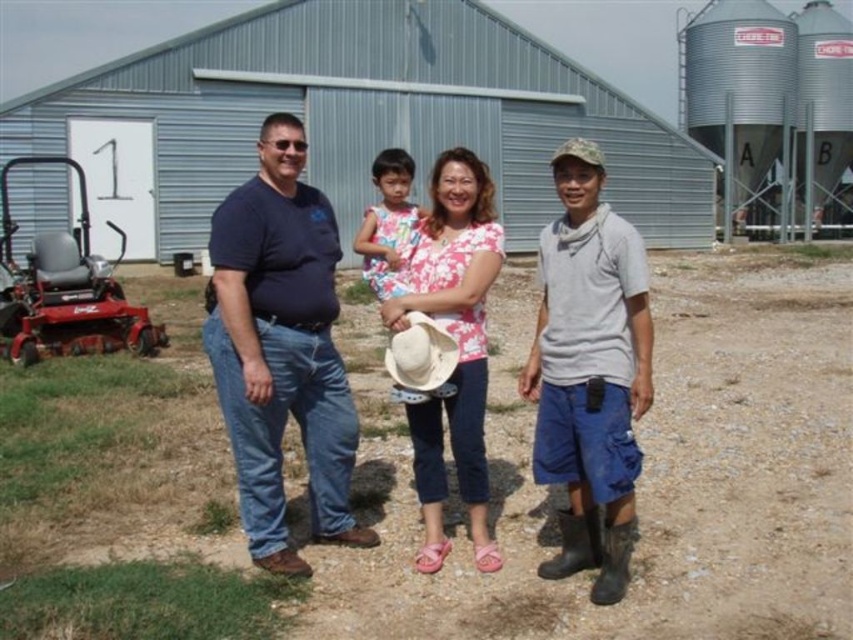
At what (x,y) coordinates should I click in order to perform the action: click on dirt at center. Please return your answer as a coordinate pair (x, y). This screenshot has width=853, height=640. Looking at the image, I should click on (451, 481).

Which is behind, point (802, 458) or point (453, 248)?

Positioned behind is point (802, 458).

The height and width of the screenshot is (640, 853). I want to click on dirt at center, so click(x=451, y=481).

Who is higher up, dirt at center or white matte cowboy hat at center?

white matte cowboy hat at center

Which is behind, point (186, 317) or point (421, 365)?

The point (186, 317) is more distant.

Is point (242, 593) in front of point (439, 358)?

Yes.

Locate an element on the screen. This screenshot has width=853, height=640. dirt at center is located at coordinates (451, 481).

Does floral fabric dress at center come in front of white matte cowboy hat at center?

No, floral fabric dress at center is further to the viewer.

Does floral fabric dress at center have a smaller size compared to white matte cowboy hat at center?

No.

The image size is (853, 640). Find the location of `floral fabric dress at center`. floral fabric dress at center is located at coordinates (387, 225).

Find the location of `floral fabric dress at center`. floral fabric dress at center is located at coordinates (387, 225).